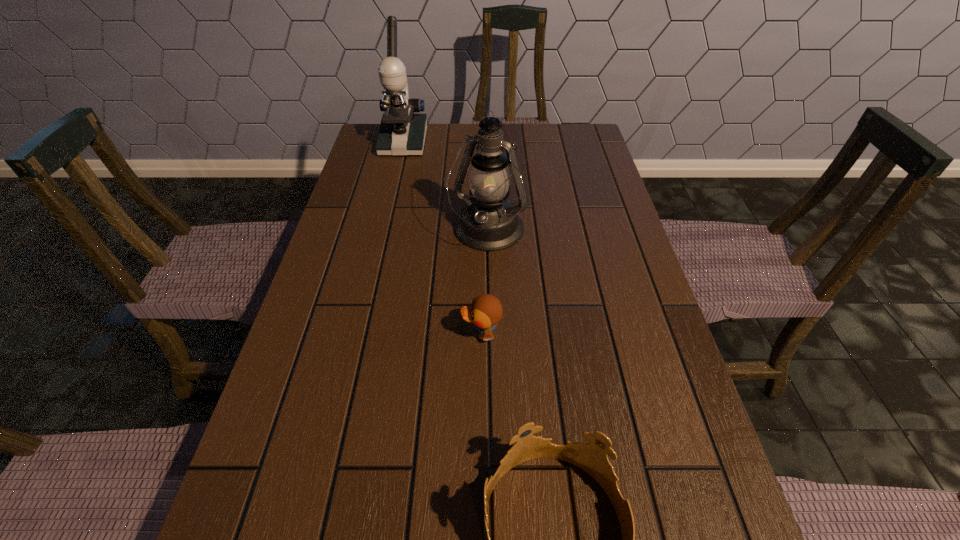
Where is `the farthest object`? the farthest object is located at coordinates (401, 133).

The image size is (960, 540). I want to click on microscope, so click(401, 133).

In order to click on the third nearest object in this screenshot , I will do `click(489, 222)`.

Identify the location of the shortest object. Image resolution: width=960 pixels, height=540 pixels. (x=486, y=311).

Image resolution: width=960 pixels, height=540 pixels. In order to click on the third farthest object in this screenshot , I will do `click(486, 311)`.

Identify the location of free point located 0.350m at the eyepiece of the farthest object. Image resolution: width=960 pixels, height=540 pixels. (383, 227).

At what (x,y) coordinates should I click in order to perform the action: click on vacant space located 0.220m on the front of the oil lamp. Please return your answer as a coordinate pair (x, y). Looking at the image, I should click on (489, 333).

Find the location of a particular element. The width and height of the screenshot is (960, 540). vacant region located 0.200m on the front-facing side of the shortest object is located at coordinates (366, 334).

You are a GUI agent. You are given a task and a screenshot of the screen. Output one action in this format:
    pyautogui.click(x=<x>, y=<y>)
    Task: Click on the free spot located 0.230m on the front-facing side of the shortest object
    
    Given the screenshot: What is the action you would take?
    pyautogui.click(x=352, y=334)

Locate an element on the screen. vacant space located 0.100m on the front-facing side of the shortest object is located at coordinates (414, 334).